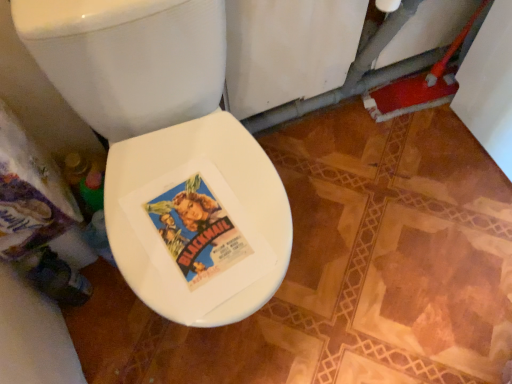
I want to click on vacant point to the right of white glossy toilet seat at center, so pos(355,285).